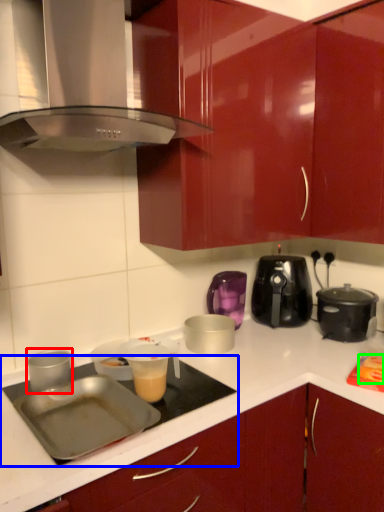
Question: Which object is the farthest from kitchen appliance (highlighted by a red box)? Choose among these: gas stove (highlighted by a blue box) or food (highlighted by a green box).

Choices:
 (A) gas stove
 (B) food

Answer: (B)